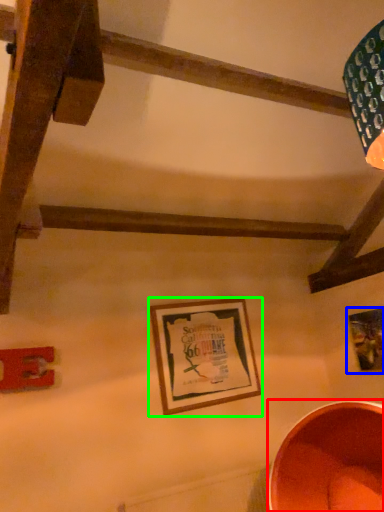
Question: Which is farther away from basin (highlighted by a red box)? picture frame (highlighted by a blue box) or picture frame (highlighted by a green box)?

Choices:
 (A) picture frame
 (B) picture frame

Answer: (B)